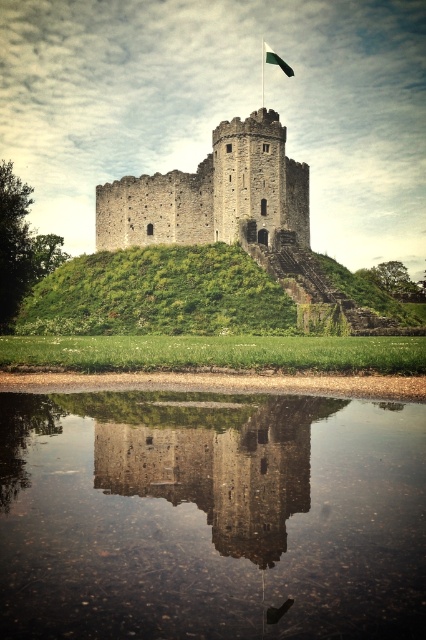
Question: Which object appears closest to the camera in this image?

Choices:
 (A) smooth stone tower at center
 (B) transparent glass water at center

Answer: (B)

Question: Which point appears farthest from the camera in this image?

Choices:
 (A) (296, 218)
 (B) (134, 586)
 (C) (267, 61)
 (D) (97, 477)

Answer: (C)

Question: Can you confirm if stone medieval tower at center is positioned below green fabric flag at upper center?

Choices:
 (A) yes
 (B) no

Answer: (A)

Question: Can you confirm if smooth stone tower at center is positioned to the left of stone medieval tower at center?

Choices:
 (A) yes
 (B) no

Answer: (B)

Question: Is stone medieval tower at center below green fabric flag at upper center?

Choices:
 (A) yes
 (B) no

Answer: (A)

Question: Which object appears closest to the camera in this image?

Choices:
 (A) smooth stone tower at center
 (B) stone medieval tower at center

Answer: (A)